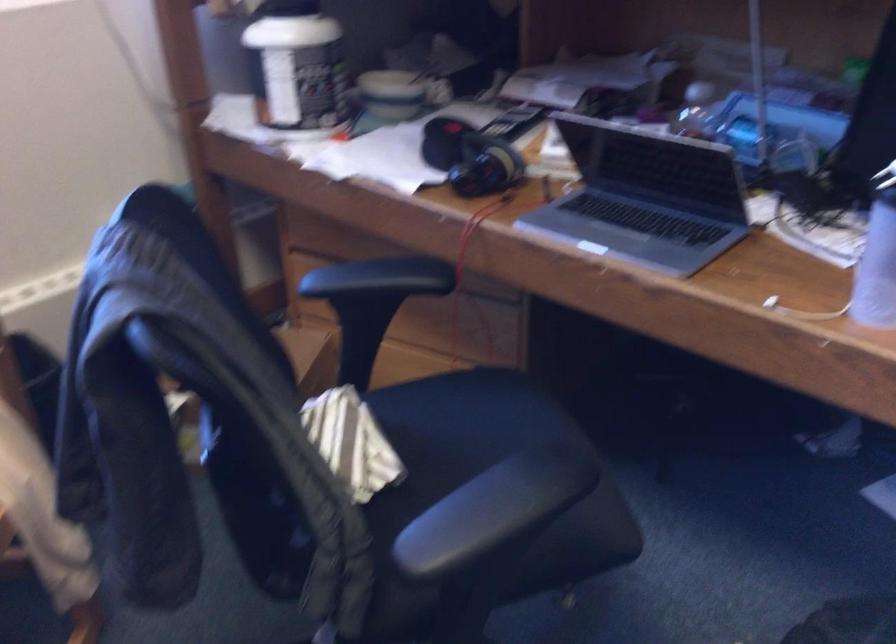
Where is `white plastic tub`? The height and width of the screenshot is (644, 896). white plastic tub is located at coordinates pyautogui.click(x=297, y=67).